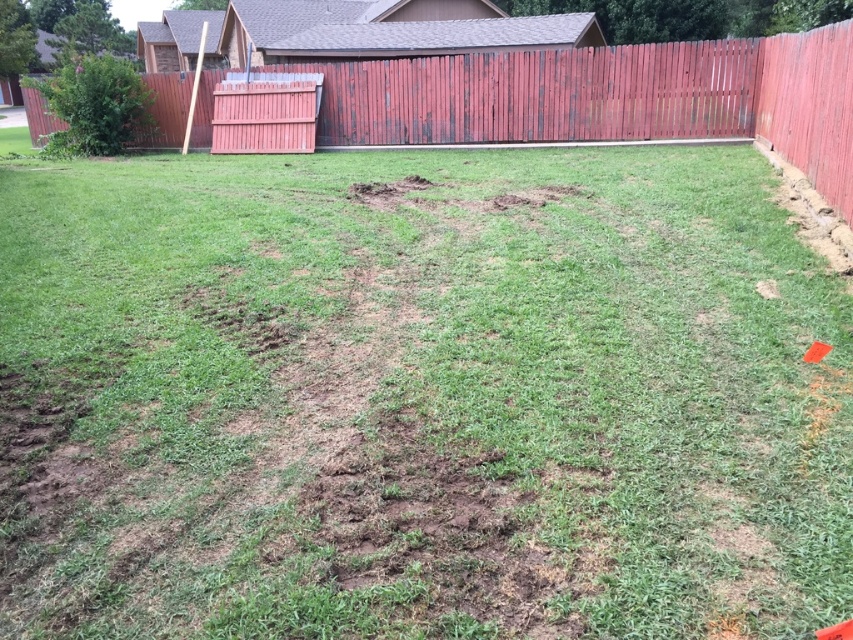
Does weathered wood fence at upper center have a greater width compared to green leafy bush at upper left?

Indeed, weathered wood fence at upper center has a greater width compared to green leafy bush at upper left.

Find the location of `weathered wood fence at upper center`. weathered wood fence at upper center is located at coordinates (612, 97).

Is point (755, 52) positioned after point (80, 88)?

No, it is in front of (80, 88).

I want to click on weathered wood fence at upper center, so click(x=612, y=97).